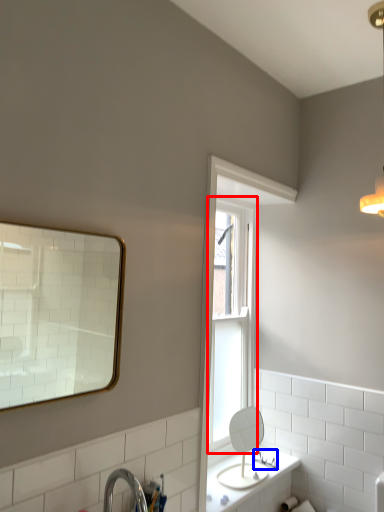
Question: Which object is further to the camera taking this photo, window (highlighted by a red box) or plumbing fixture (highlighted by a blue box)?

Choices:
 (A) window
 (B) plumbing fixture

Answer: (B)